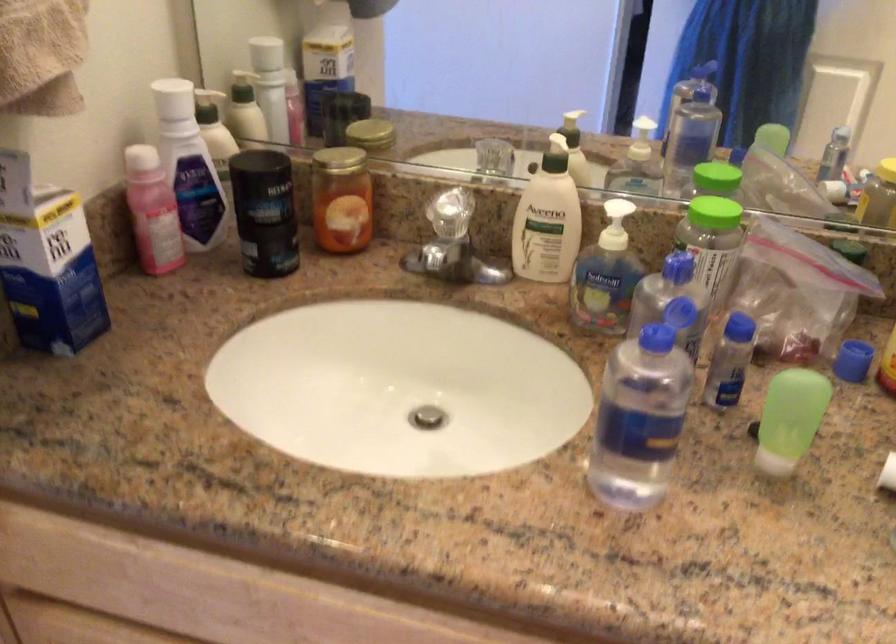
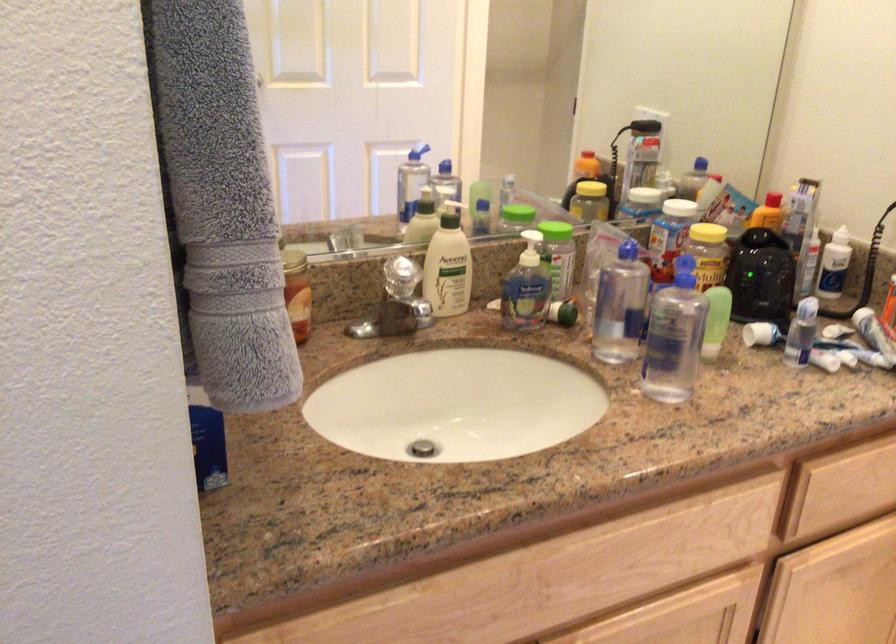
Question: I am providing you with two images of the same scene from different viewpoints. Please identify which objects are invisible in image2.

Choices:
 (A) white product tube
 (B) green soap pump
 (C) bottle pump dispenser
 (D) beige shoe

Answer: (C)